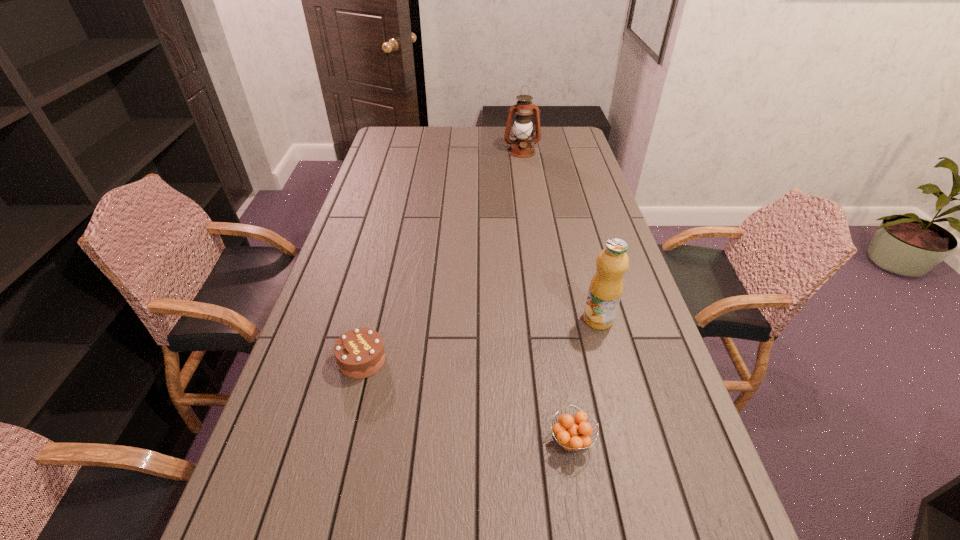
This screenshot has height=540, width=960. Find the location of `free area in between the fruit juice and the lantern`. free area in between the fruit juice and the lantern is located at coordinates (560, 235).

The width and height of the screenshot is (960, 540). I want to click on vacant space that is in between the orange fruit and the fruit juice, so click(x=585, y=380).

This screenshot has height=540, width=960. In order to click on free spot between the farthest object and the leftmost object in this screenshot , I will do `click(443, 256)`.

Locate an element on the screen. object that can be found as the closest to the farthest object is located at coordinates (606, 286).

This screenshot has height=540, width=960. Find the location of `object that is the third closest to the nearest object`. object that is the third closest to the nearest object is located at coordinates (521, 147).